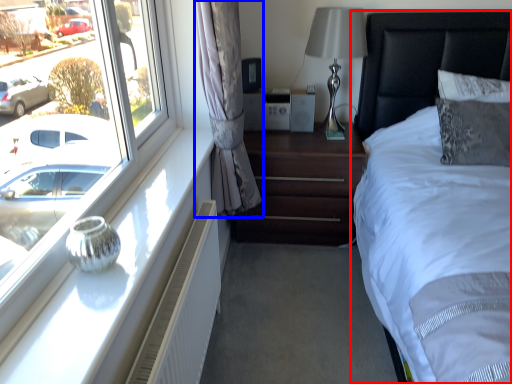
Question: Which object is closer to the camera taking this photo, bed (highlighted by a red box) or curtain (highlighted by a blue box)?

Choices:
 (A) bed
 (B) curtain

Answer: (A)